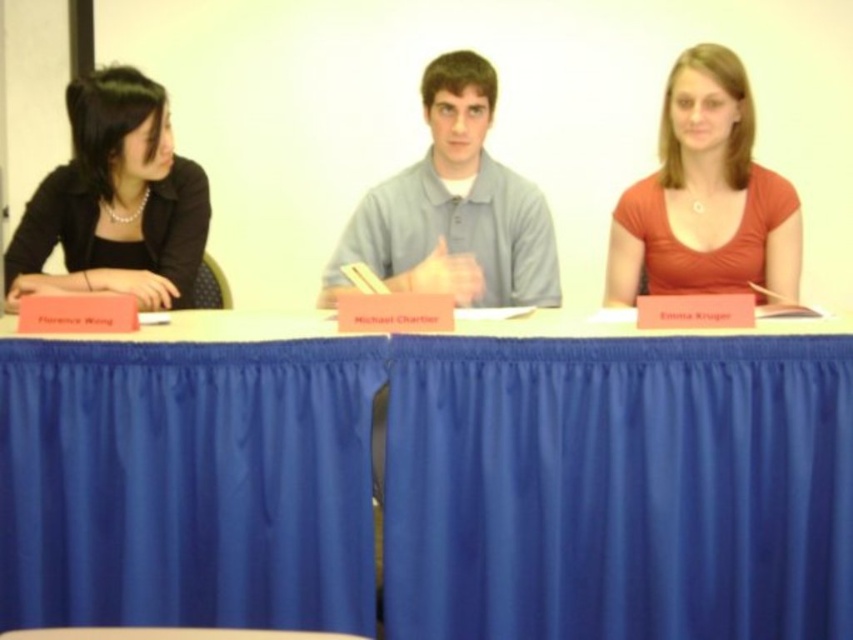
Is point (744, 582) less distant than point (711, 170)?

Yes.

Which is behind, point (247, 513) or point (770, 244)?

The point (770, 244) is more distant.

The width and height of the screenshot is (853, 640). Find the location of `blue fabric table at center`. blue fabric table at center is located at coordinates (434, 480).

Who is more distant from viewer, (543, 497) or (125, 188)?

Point (125, 188)

Does point (751, 342) come in front of point (155, 134)?

Yes.

The height and width of the screenshot is (640, 853). Identify the location of blue fabric table at center. (434, 480).

Where is `black matte blazer at left`? The height and width of the screenshot is (640, 853). black matte blazer at left is located at coordinates (115, 200).

Can you confirm if black matte blazer at left is taller than gray cotton shirt at center?

No, black matte blazer at left is not taller than gray cotton shirt at center.

Is point (73, 193) positioned in front of point (396, 218)?

Yes, point (73, 193) is closer to viewer.

Where is `black matte blazer at left`? black matte blazer at left is located at coordinates (115, 200).